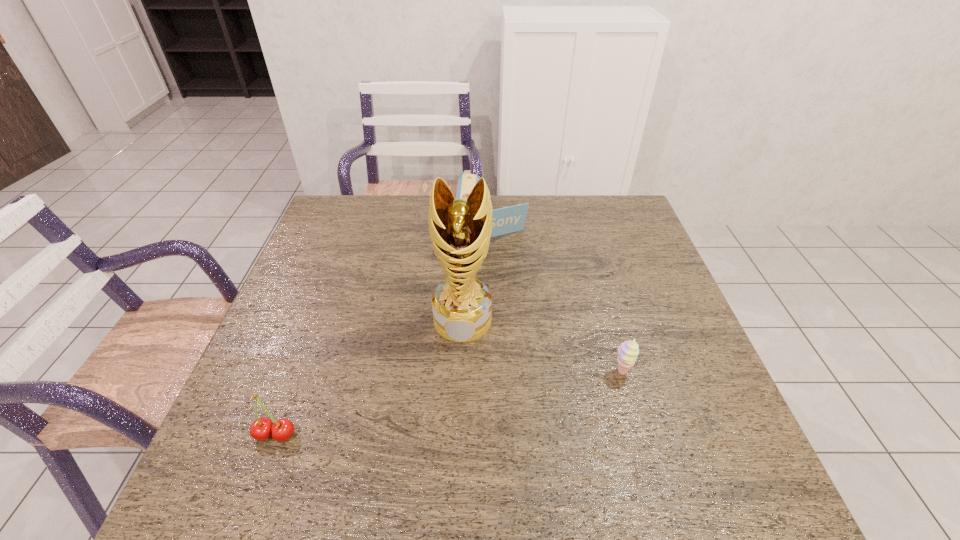
Identify the location of vacant space on the desktop that is between the cherry and the third farthest object and is positioned on the side of the camcorder with the flip-out screen. (487, 396).

Locate an element on the screen. Image resolution: width=960 pixels, height=540 pixels. vacant spot on the desktop that is between the nearest object and the second nearest object and is positioned on the front-facing side of the second farthest object is located at coordinates (454, 402).